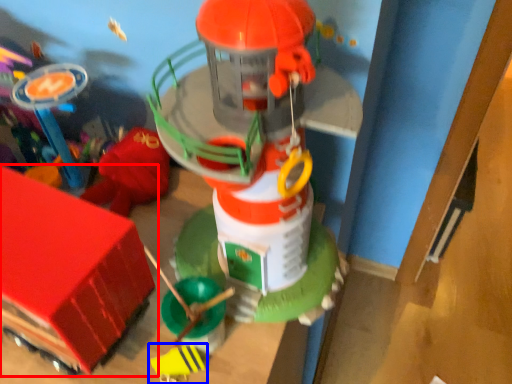
Question: Which point is closer to the camera, toy (highlighted by a red box) or toy (highlighted by a blue box)?

Choices:
 (A) toy
 (B) toy

Answer: (A)